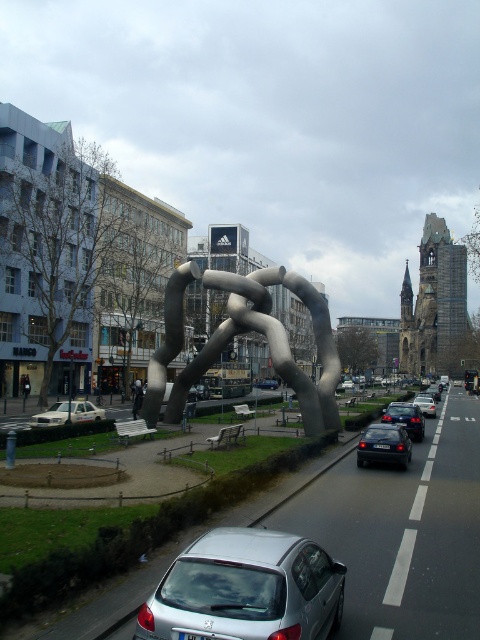
From the picture: You are a city planner analyzing this urban scene. The polished silver sculpture at center is located at coordinates 0.537, 0.560. If you want to place a new bench exactly 0.1 units to the right of the sculpture, what would be the new coordinates for the bench?

The new coordinates for the bench would be approximately [268,406], since moving 0.1 units to the right adds 0.1 to the x coordinate while keeping the y coordinate the same as the polished silver sculpture at center.

You are a photographer trying to capture both the polished silver sculpture at center and the white matte car at lower left in a single frame. Based on their positions, which object should you place on the right side of your camera viewfinder to ensure both are included?

The polished silver sculpture at center is to the right of the white matte car at lower left, so you should place the polished silver sculpture at center on the right side of your camera viewfinder to include both in the frame.